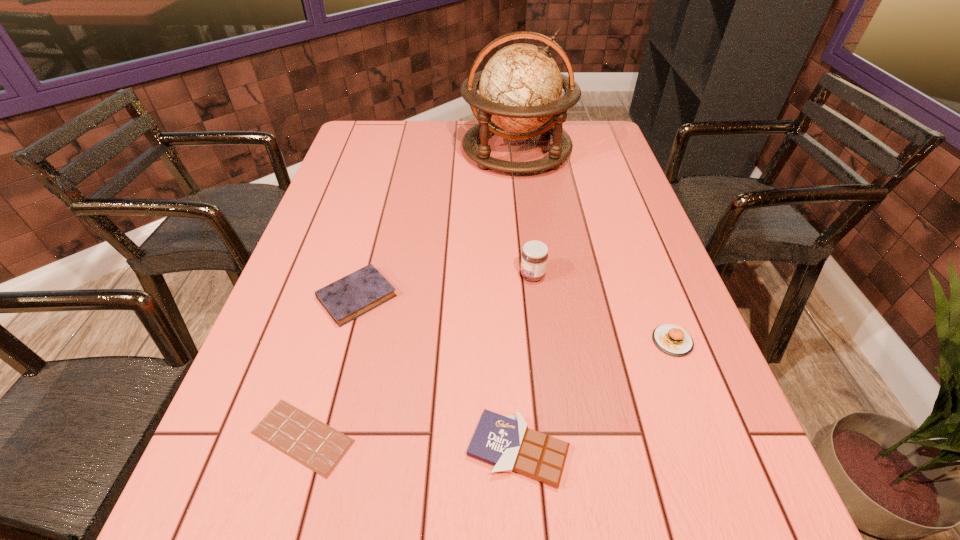
This screenshot has width=960, height=540. In order to click on food at the right edge in this screenshot , I will do `click(671, 339)`.

At what (x,y) coordinates should I click in order to perform the action: click on object that is at the far right corner. Please return your answer as a coordinate pair (x, y). Image resolution: width=960 pixels, height=540 pixels. Looking at the image, I should click on (520, 88).

Where is `free space at the far edge`? This screenshot has height=540, width=960. free space at the far edge is located at coordinates [492, 139].

Locate an element on the screen. Image resolution: width=960 pixels, height=540 pixels. vacant space at the near edge of the desktop is located at coordinates (323, 523).

Identify the location of vacant region at the left edge of the desktop. tap(365, 231).

This screenshot has height=540, width=960. What are the coordinates of `vacant space at the right edge` in the screenshot? It's located at (725, 396).

Where is `free spot at the far left corner of the desktop`? free spot at the far left corner of the desktop is located at coordinates (364, 122).

Image resolution: width=960 pixels, height=540 pixels. In the image, there is a desktop. Find the location of `vacant space at the near right corner`. vacant space at the near right corner is located at coordinates (684, 517).

Locate an element on the screen. This screenshot has width=960, height=540. vacant space in between the fifth shortest object and the right chocolate bar is located at coordinates (525, 362).

This screenshot has width=960, height=540. I want to click on vacant area between the food and the shortest object, so click(488, 389).